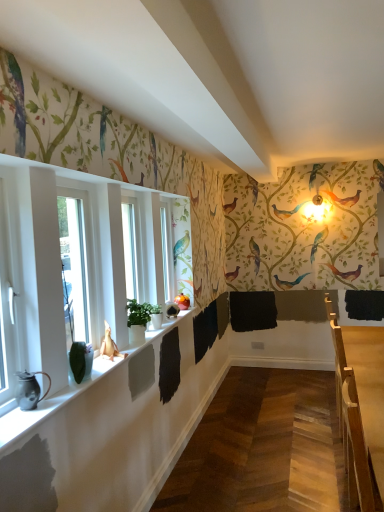
Question: From a real-world perspective, is wooden table at right located beneath white glossy window at left?

Choices:
 (A) yes
 (B) no

Answer: (A)

Question: Is wooden table at right wider than white glossy window at left?

Choices:
 (A) yes
 (B) no

Answer: (A)

Question: Is white glossy window at left completely or partially inside wooden table at right?

Choices:
 (A) yes
 (B) no

Answer: (B)

Question: From a real-world perspective, is wooden table at right on top of white glossy window at left?

Choices:
 (A) yes
 (B) no

Answer: (B)

Question: Is the depth of wooden table at right less than that of white glossy window at left?

Choices:
 (A) yes
 (B) no

Answer: (B)

Question: From the image's perspective, is wooden table at right below white glossy window at left?

Choices:
 (A) yes
 (B) no

Answer: (A)

Question: Considering the relative sizes of white glossy window at left and wooden table at right in the image provided, is white glossy window at left wider than wooden table at right?

Choices:
 (A) no
 (B) yes

Answer: (A)

Question: Is white glossy window at left facing away from wooden table at right?

Choices:
 (A) no
 (B) yes

Answer: (A)

Question: Is white glossy window at left positioned before wooden table at right?

Choices:
 (A) yes
 (B) no

Answer: (A)

Question: Is white glossy window at left aimed at wooden table at right?

Choices:
 (A) yes
 (B) no

Answer: (B)

Question: Considering the relative sizes of white glossy window at left and wooden table at right in the image provided, is white glossy window at left shorter than wooden table at right?

Choices:
 (A) yes
 (B) no

Answer: (A)

Question: Is white glossy window at left outside of wooden table at right?

Choices:
 (A) yes
 (B) no

Answer: (A)

Question: Is green matte plant at left not inside wooden table at right?

Choices:
 (A) no
 (B) yes

Answer: (B)